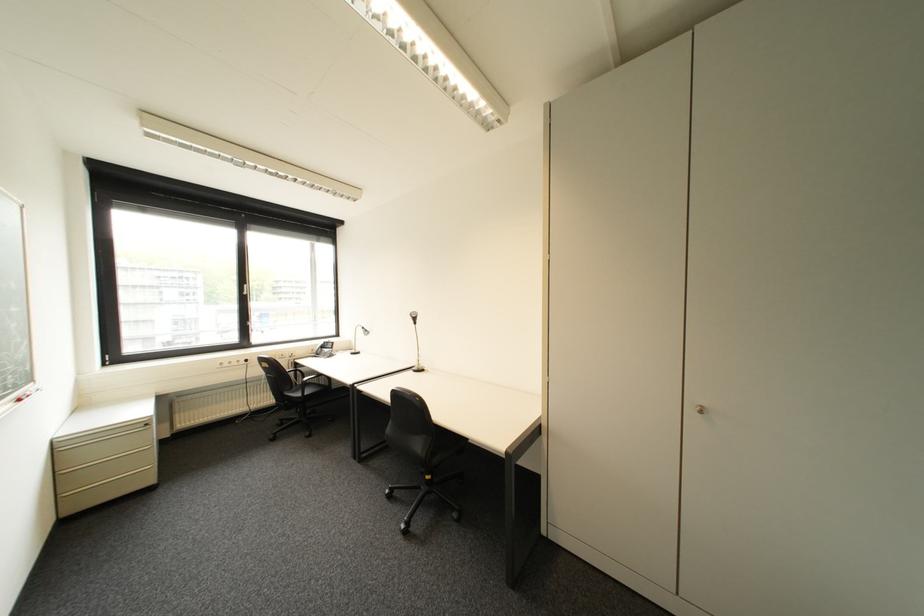
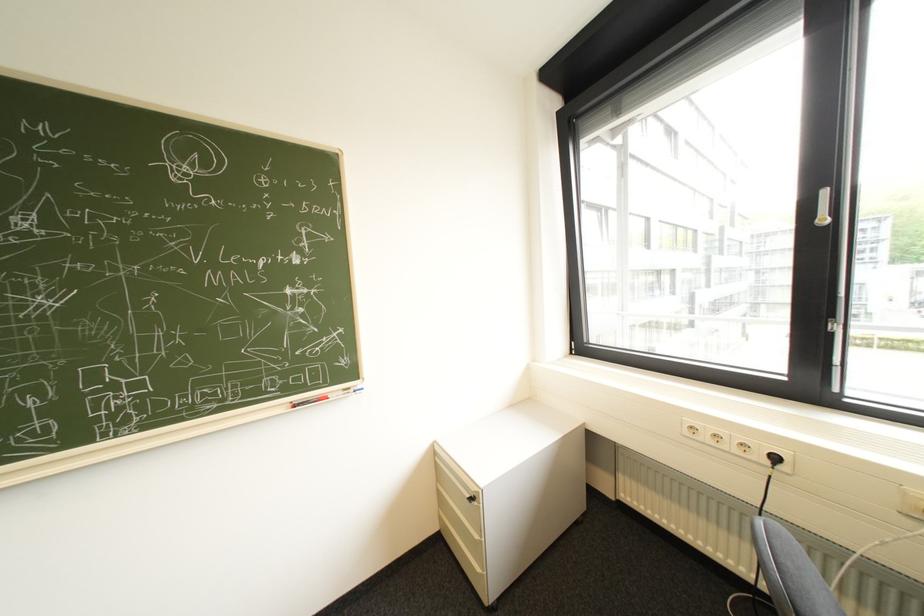
Find the pixel in the second image that matches point (228, 367) in the first image.

(698, 434)